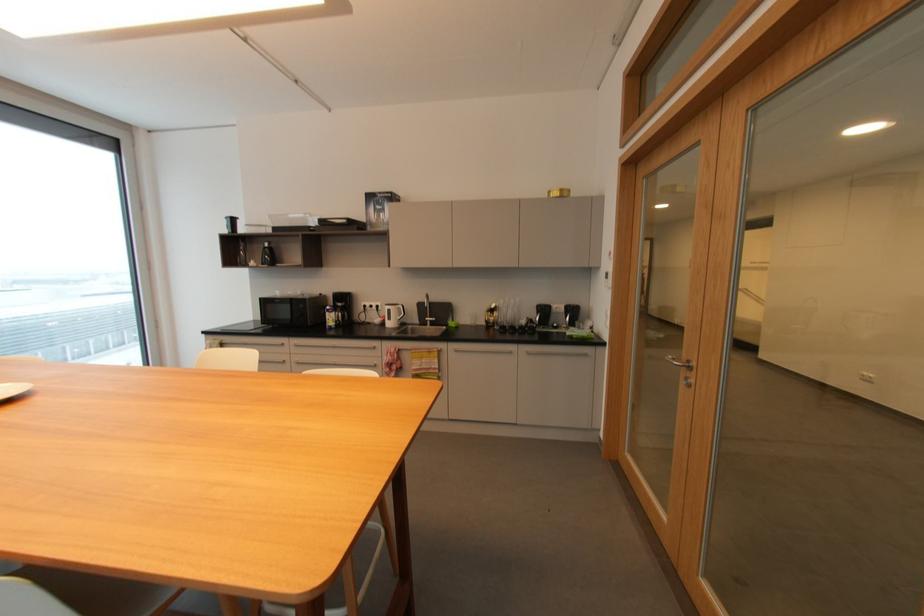
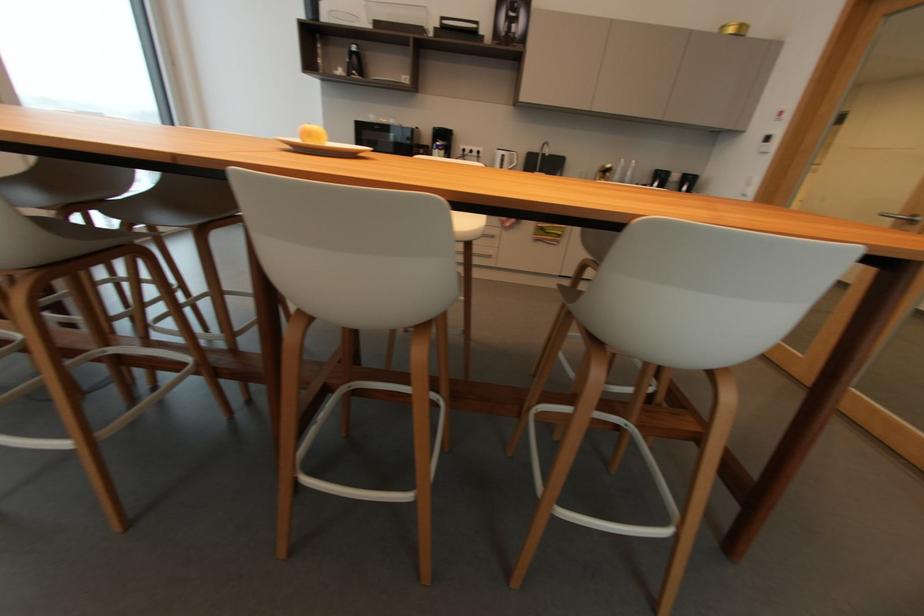
Question: What movement of the cameraman would produce the second image?

Choices:
 (A) Left
 (B) Right
 (C) Forward
 (D) Backward

Answer: (A)